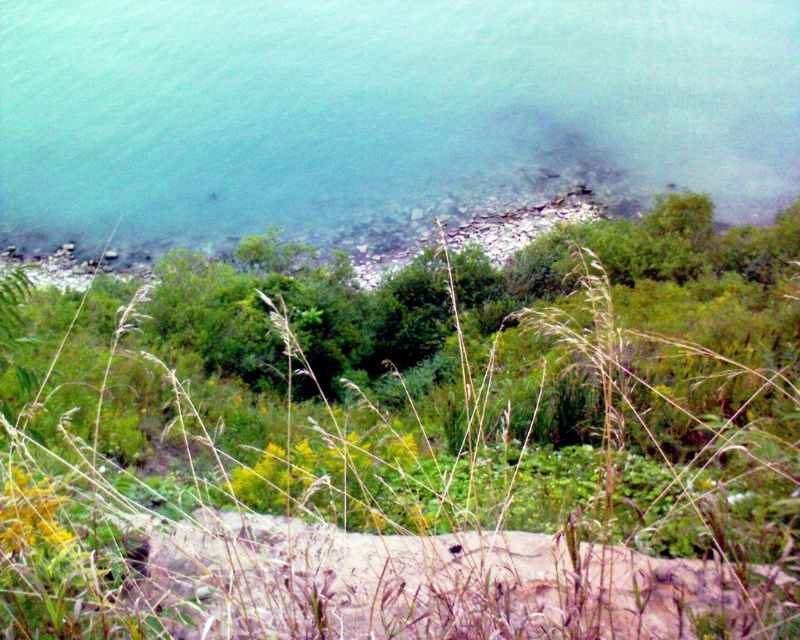
Question: In this image, where is green grass at center located relative to clear water at lower left?

Choices:
 (A) below
 (B) above

Answer: (A)

Question: Which of the following is the farthest from the observer?

Choices:
 (A) clear water at lower left
 (B) green grass at center

Answer: (A)

Question: Observing the image, what is the correct spatial positioning of green grass at center in reference to clear water at lower left?

Choices:
 (A) above
 (B) below

Answer: (B)

Question: Can you confirm if green grass at center is positioned to the right of clear water at lower left?

Choices:
 (A) no
 (B) yes

Answer: (B)

Question: Which object is farther from the camera taking this photo?

Choices:
 (A) clear water at lower left
 (B) green grass at center

Answer: (A)

Question: Which object appears closest to the camera in this image?

Choices:
 (A) clear water at lower left
 (B) green grass at center

Answer: (B)